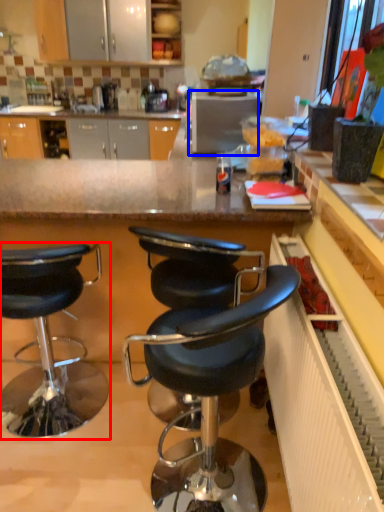
Question: Which object appears closest to the camera in this image, chair (highlighted by a red box) or appliance (highlighted by a blue box)?

Choices:
 (A) chair
 (B) appliance

Answer: (A)